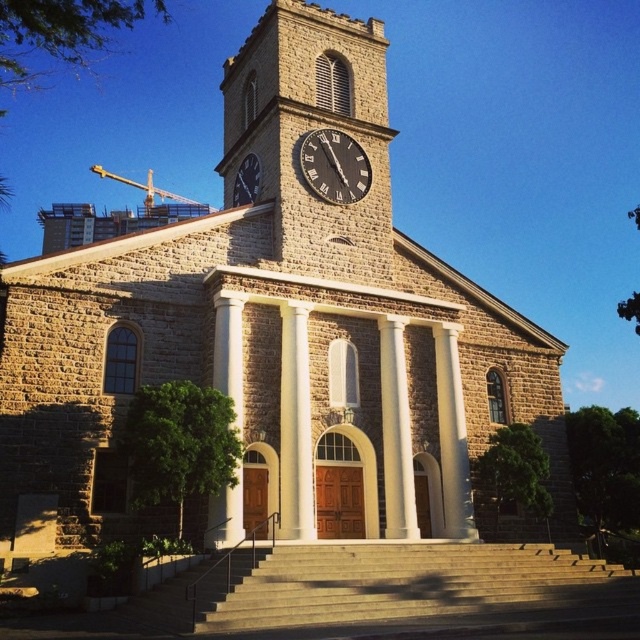
Consider the image. You are an architect visiting the historic stone church and notice the brown stone clock tower at upper center and the black matte clock at center. Which structure appears bigger in the image?

The brown stone clock tower at upper center appears bigger than the black matte clock at center because it has a larger size compared to it.

In the scene shown: You are standing in front of the historic stone church with a clock tower. You notice a point at coordinates point (x=307, y=180). If you want to reach that point, which direction should you move relative to your current position?

The point (x=307, y=180) is 46.71 meters away from you, so you should move forward towards the church to reach it.